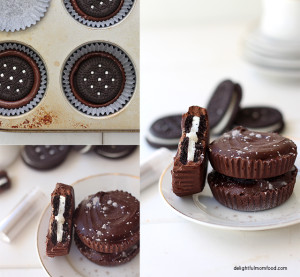
Find the location of `plate rim`. plate rim is located at coordinates (265, 227), (41, 258).